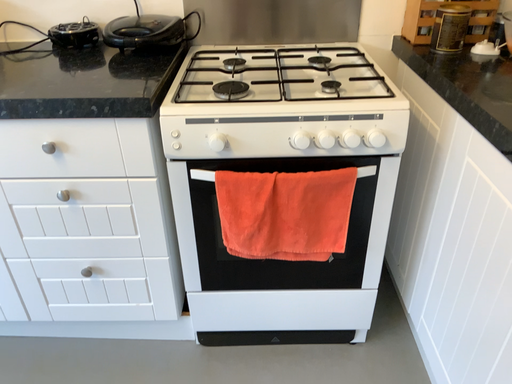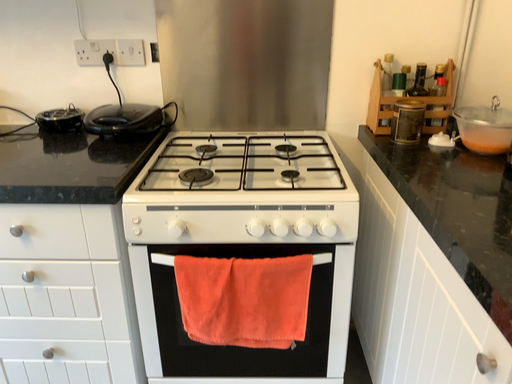
Question: How did the camera likely rotate when shooting the video?

Choices:
 (A) rotated upward
 (B) rotated downward

Answer: (A)